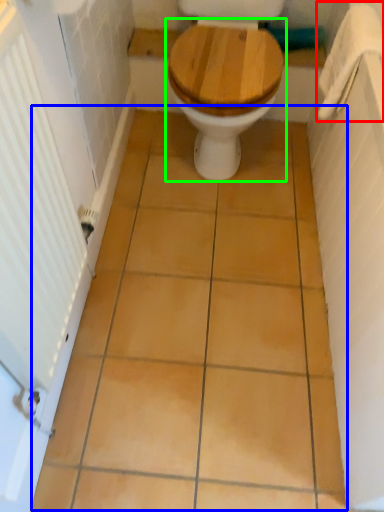
Question: Considering the real-world distances, which object is farthest from towel bar (highlighted by a red box)? ceramic tile (highlighted by a blue box) or toilet (highlighted by a green box)?

Choices:
 (A) ceramic tile
 (B) toilet

Answer: (A)